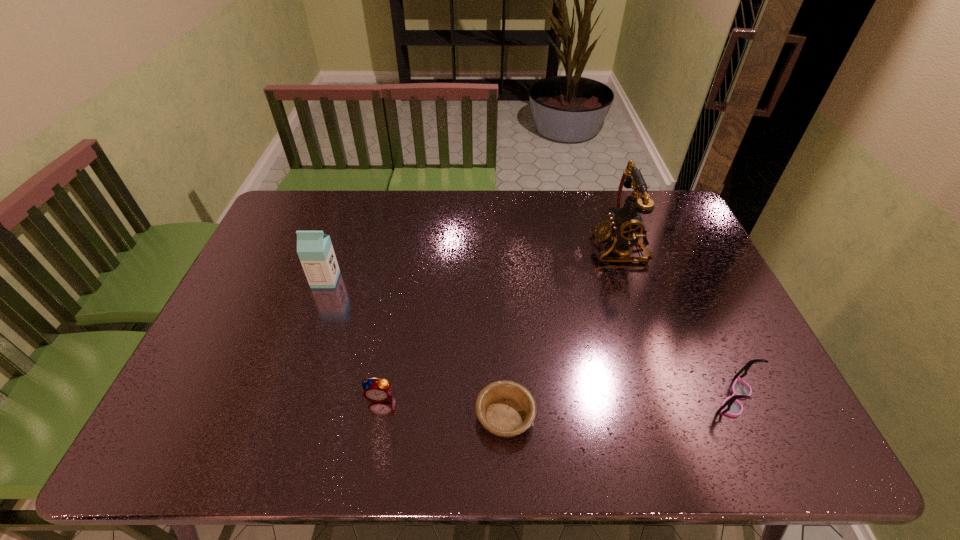
Find the location of a particular element. object present at the near right corner is located at coordinates (731, 406).

This screenshot has width=960, height=540. Identify the location of vacant space at the far edge of the desktop. (521, 191).

Identify the location of vacant space at the near edge of the desktop. (660, 456).

The height and width of the screenshot is (540, 960). Find the location of `vacant space at the left edge of the desktop`. vacant space at the left edge of the desktop is located at coordinates (264, 286).

In the image, there is a desktop. What are the coordinates of `vacant region at the right edge` in the screenshot? It's located at tap(720, 313).

In the image, there is a desktop. Identify the location of vacant space at the far left corner. (287, 200).

In the image, there is a desktop. In order to click on vacant area at the far right corner in this screenshot , I will do `click(650, 221)`.

I want to click on empty space that is in between the spectacles and the leftmost object, so click(x=530, y=339).

At what (x,y) coordinates should I click in order to perform the action: click on vacant region between the tallest object and the alarm clock. Please return your answer as a coordinate pair (x, y). This screenshot has height=540, width=960. Looking at the image, I should click on (500, 321).

Find the location of a particular element. Image resolution: width=960 pixels, height=540 pixels. free spot between the fourth object from right to left and the rightmost object is located at coordinates (557, 397).